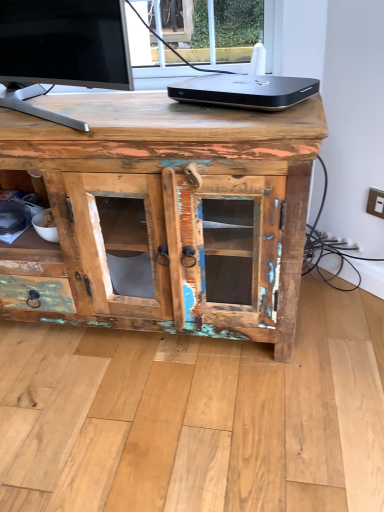
Locate an element on the screen. This screenshot has height=512, width=384. vacant area situated to the left side of black metallic device at upper center is located at coordinates (110, 110).